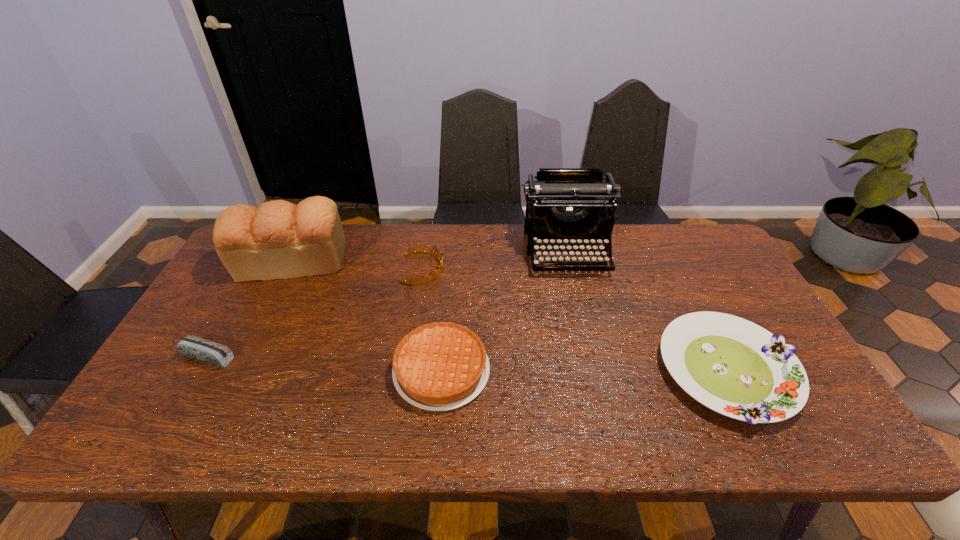
Find the location of a particular element. Image resolution: width=960 pixels, height=540 pixels. vacant point located between the rightmost object and the third tallest object is located at coordinates (575, 319).

Identify the location of vacant area between the fifth object from left to right and the salad plate. (647, 311).

Identify the location of free spot between the tiara and the pencil box. (313, 312).

Image resolution: width=960 pixels, height=540 pixels. I want to click on free spot between the fourth shortest object and the salad plate, so click(575, 319).

Find the location of a particular element. vacant area that lies between the tiara and the pie is located at coordinates coord(432,319).

Where is `vacant space in between the pencil box and the tiara`? The image size is (960, 540). vacant space in between the pencil box and the tiara is located at coordinates (313, 312).

Where is `vacant point located between the rightmost object and the fourth shortest object`? vacant point located between the rightmost object and the fourth shortest object is located at coordinates (575, 319).

At what (x,y) coordinates should I click in order to perform the action: click on vacant region between the tiara and the pencil box. Please return your answer as a coordinate pair (x, y). The height and width of the screenshot is (540, 960). Looking at the image, I should click on (313, 312).

Where is `object that ranks as the fourth closest to the bread`? object that ranks as the fourth closest to the bread is located at coordinates click(564, 203).

Locate an element on the screen. The image size is (960, 540). the fifth closest object to the pencil box is located at coordinates (735, 367).